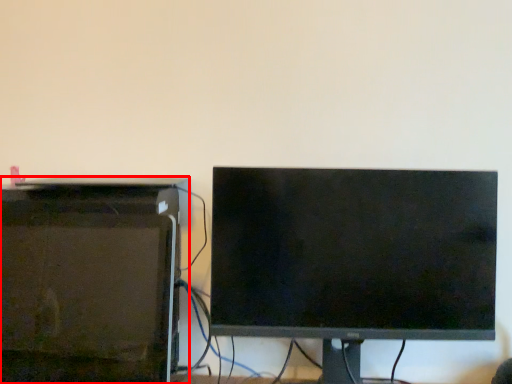
Question: From the image's perspective, what is the correct spatial relationship of desktop computer (annotated by the red box) in relation to computer monitor?

Choices:
 (A) below
 (B) above

Answer: (A)